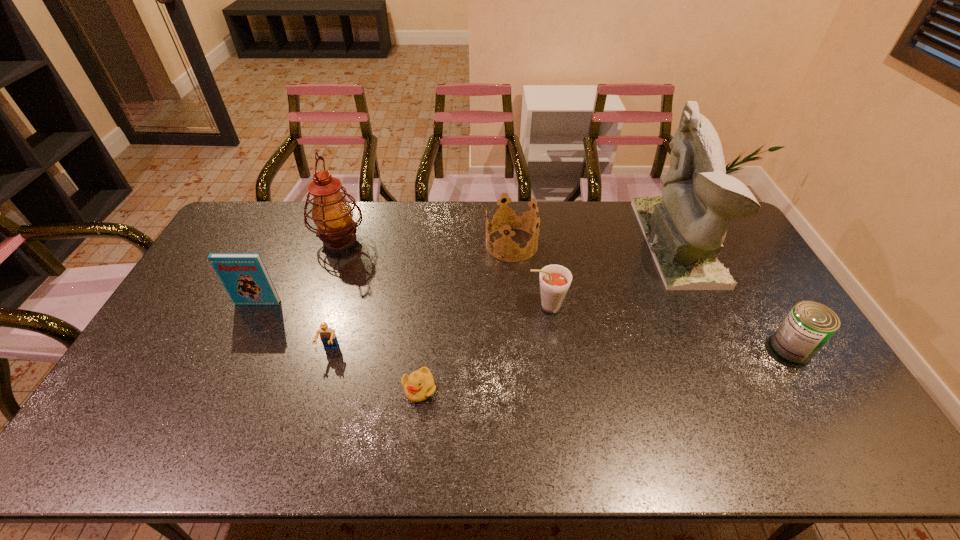
This screenshot has height=540, width=960. Identify the location of the second object from right to left. (685, 227).

This screenshot has height=540, width=960. I want to click on the tallest object, so click(685, 227).

Where is `the second tallest object`? The height and width of the screenshot is (540, 960). the second tallest object is located at coordinates (331, 212).

Image resolution: width=960 pixels, height=540 pixels. Identify the location of the leftmost object. (244, 275).

At what (x,y) coordinates should I click in order to perform the action: click on root beer. Please return your answer as a coordinate pair (x, y). Looking at the image, I should click on (555, 280).

What are the coordinates of `crown` in the screenshot? It's located at (513, 219).

The width and height of the screenshot is (960, 540). In order to click on can in this screenshot , I will do `click(809, 325)`.

The width and height of the screenshot is (960, 540). I want to click on the second shortest object, so click(x=328, y=337).

This screenshot has height=540, width=960. I want to click on the nearest object, so click(419, 385).

Where is `the fifth object from right to left`? This screenshot has width=960, height=540. the fifth object from right to left is located at coordinates (419, 385).